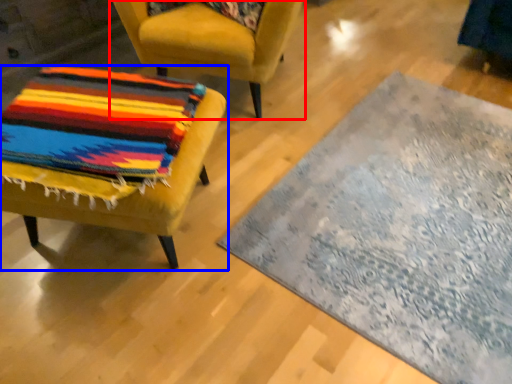
Question: Which of the following is the farthest to the observer, chair (highlighted by a red box) or chair (highlighted by a blue box)?

Choices:
 (A) chair
 (B) chair

Answer: (A)